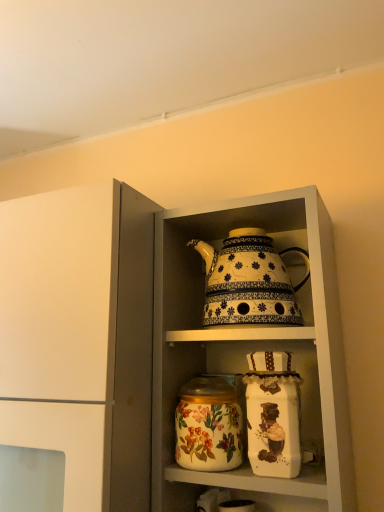
Question: From a real-world perspective, does white glossy teapot at upper center sit lower than decorative ceramic teapot at center?

Choices:
 (A) yes
 (B) no

Answer: (A)

Question: Is white glossy teapot at upper center positioned beyond the bounds of decorative ceramic teapot at center?

Choices:
 (A) no
 (B) yes

Answer: (B)

Question: Can you confirm if white glossy teapot at upper center is wider than decorative ceramic teapot at center?

Choices:
 (A) yes
 (B) no

Answer: (A)

Question: Is white glossy teapot at upper center aimed at decorative ceramic teapot at center?

Choices:
 (A) no
 (B) yes

Answer: (B)

Question: Does white glossy teapot at upper center have a lesser width compared to decorative ceramic teapot at center?

Choices:
 (A) no
 (B) yes

Answer: (A)

Question: Is decorative ceramic teapot at center bigger or smaller than white glossy teapot at upper center?

Choices:
 (A) big
 (B) small

Answer: (B)

Question: Looking at their shapes, would you say decorative ceramic teapot at center is wider or thinner than white glossy teapot at upper center?

Choices:
 (A) wide
 (B) thin

Answer: (B)

Question: Would you say decorative ceramic teapot at center is to the left or to the right of white glossy teapot at upper center in the picture?

Choices:
 (A) left
 (B) right

Answer: (A)

Question: Considering the positions of point (266, 311) and point (92, 211), is point (266, 311) closer or farther from the camera than point (92, 211)?

Choices:
 (A) farther
 (B) closer

Answer: (A)

Question: Is decorative ceramic teapot at center inside or outside of floral-patterned ceramic jar at center?

Choices:
 (A) outside
 (B) inside

Answer: (A)

Question: Does point (284, 301) appear closer or farther from the camera than point (203, 407)?

Choices:
 (A) farther
 (B) closer

Answer: (A)

Question: Is decorative ceramic teapot at center taller or shorter than floral-patterned ceramic jar at center?

Choices:
 (A) short
 (B) tall

Answer: (B)

Question: Is decorative ceramic teapot at center in front of or behind floral-patterned ceramic jar at center in the image?

Choices:
 (A) front
 (B) behind

Answer: (B)

Question: Is white glossy teapot at upper center wider or thinner than floral-patterned ceramic jar at center?

Choices:
 (A) wide
 (B) thin

Answer: (A)

Question: Based on their sizes in the image, would you say white glossy teapot at upper center is bigger or smaller than floral-patterned ceramic jar at center?

Choices:
 (A) small
 (B) big

Answer: (B)